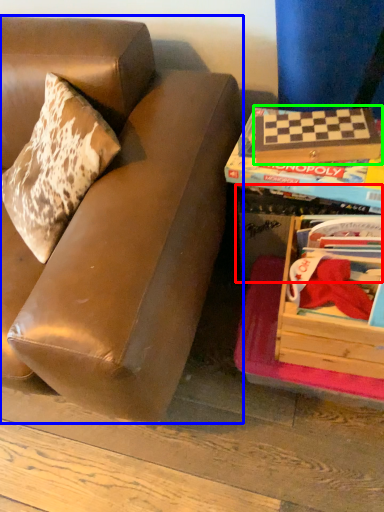
Question: Which is nearer to the storage box (highlighted by a red box)? studio couch (highlighted by a blue box) or paperback book (highlighted by a green box).

Choices:
 (A) studio couch
 (B) paperback book

Answer: (B)